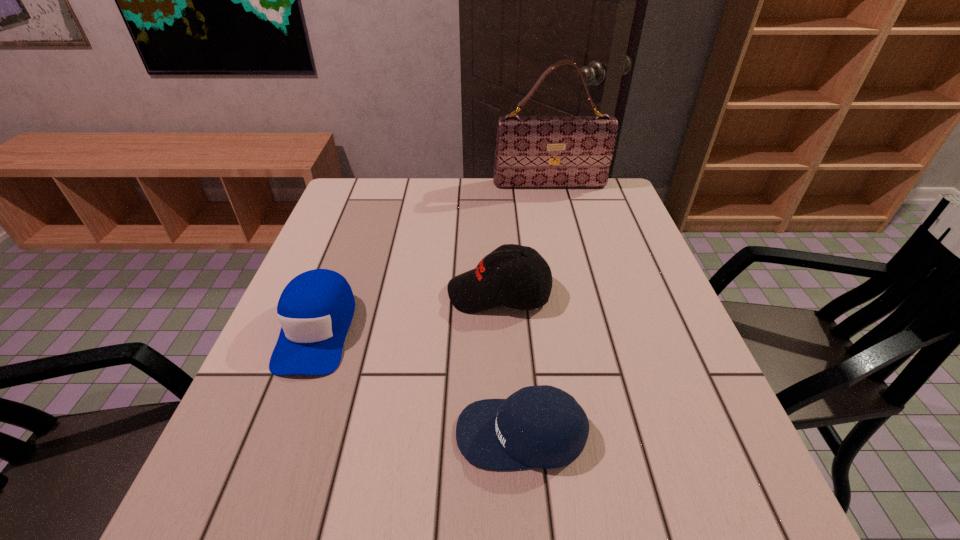
Where is `vacant area at the far right corner of the desktop`? The image size is (960, 540). vacant area at the far right corner of the desktop is located at coordinates (586, 216).

Image resolution: width=960 pixels, height=540 pixels. I want to click on blank region between the shortest object and the leftmost object, so click(x=420, y=381).

You are a GUI agent. You are given a task and a screenshot of the screen. Output one action in this format:
    pyautogui.click(x=<x>, y=<y>)
    Task: Click on the free space between the shortest baseball cap and the handbag
    
    Given the screenshot: What is the action you would take?
    pyautogui.click(x=536, y=309)

Locate which object is the closest to the shortest baseball cap. Please provide its 2D coordinates. Your answer should be formatted as a tuple, i.e. [(x, y)], where the tuple contains the x and y coordinates of a point satisfying the conditions above.

[(496, 280)]

I want to click on the third closest object to the farthest object, so click(542, 426).

This screenshot has height=540, width=960. I want to click on baseball cap that is the nearest to the shortest object, so (x=496, y=280).

Identify which baseball cap is located as the second nearest to the nearest baseball cap. Please provide its 2D coordinates. Your answer should be formatted as a tuple, i.e. [(x, y)], where the tuple contains the x and y coordinates of a point satisfying the conditions above.

[(315, 309)]

Locate an element on the screen. The image size is (960, 540). vacant space that satisfies the following two spatial constraints: 1. on the front of the handbag with the clasp; 2. on the front-facing side of the shortest baseball cap is located at coordinates (609, 433).

Where is `vacant point that satisfies the following two spatial constraints: 1. on the front of the handbag with the clasp; 2. on the front-facing side of the nearest object`? Image resolution: width=960 pixels, height=540 pixels. vacant point that satisfies the following two spatial constraints: 1. on the front of the handbag with the clasp; 2. on the front-facing side of the nearest object is located at coordinates (609, 433).